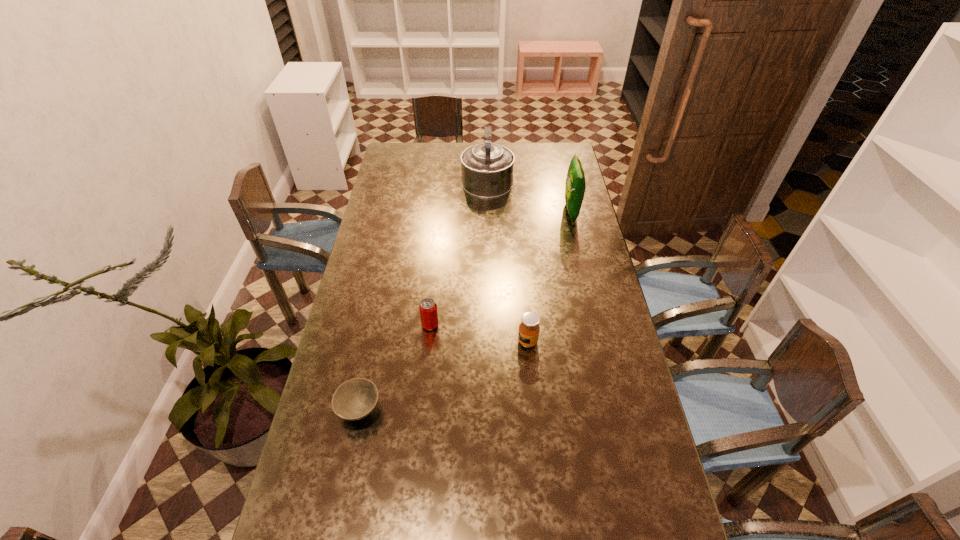
Find the location of a particular element. The image size is (960, 540). empty location between the second nearest object and the can is located at coordinates (479, 333).

This screenshot has height=540, width=960. I want to click on free space between the third nearest object and the leftmost object, so click(x=396, y=367).

You are a GUI agent. You are given a task and a screenshot of the screen. Output one action in this format:
    pyautogui.click(x=<x>, y=<y>)
    Task: Click on the vacant area between the shortest object and the second object from left to right
    The height and width of the screenshot is (540, 960).
    Given the screenshot: What is the action you would take?
    pyautogui.click(x=396, y=367)

Find the location of a particular element. This screenshot has height=540, width=960. free point between the kettle and the third farthest object is located at coordinates (459, 252).

This screenshot has height=540, width=960. In order to click on empty space between the second farthest object and the leftmost object in this screenshot , I will do `click(466, 311)`.

Locate an element on the screen. free space between the farthest object and the fourth nearest object is located at coordinates (529, 195).

Identify the location of free space between the kettle and the shortest object. This screenshot has height=540, width=960. (423, 294).

Identify the location of object that can be found as the fourth closest to the honey. (487, 169).

In order to click on object that is the closest to the leftmost object in this screenshot , I will do `click(428, 308)`.